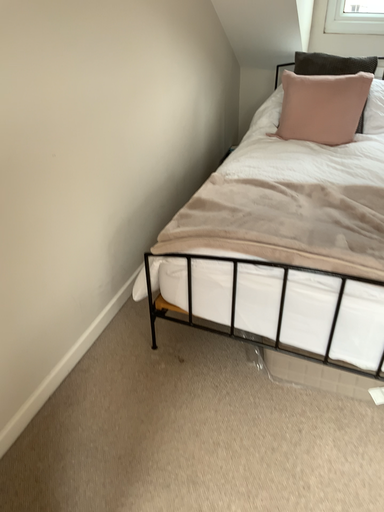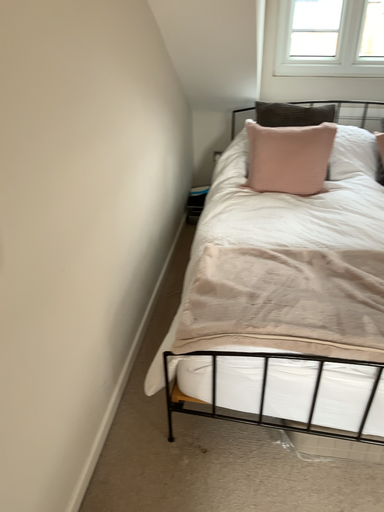
Question: Which way did the camera rotate in the video?

Choices:
 (A) rotated left
 (B) rotated right

Answer: (B)